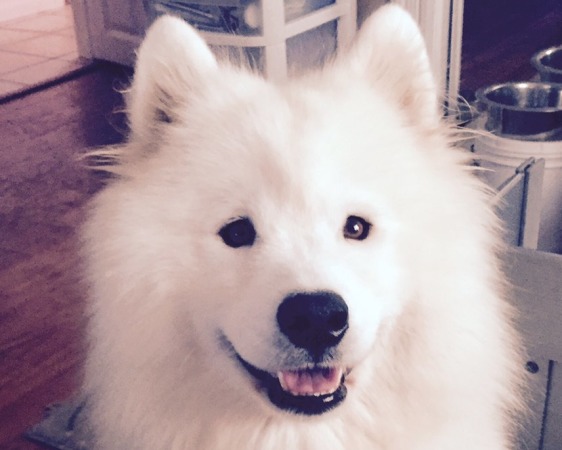
Where is `bins`? The height and width of the screenshot is (450, 562). bins is located at coordinates (x=251, y=48), (x=247, y=22).